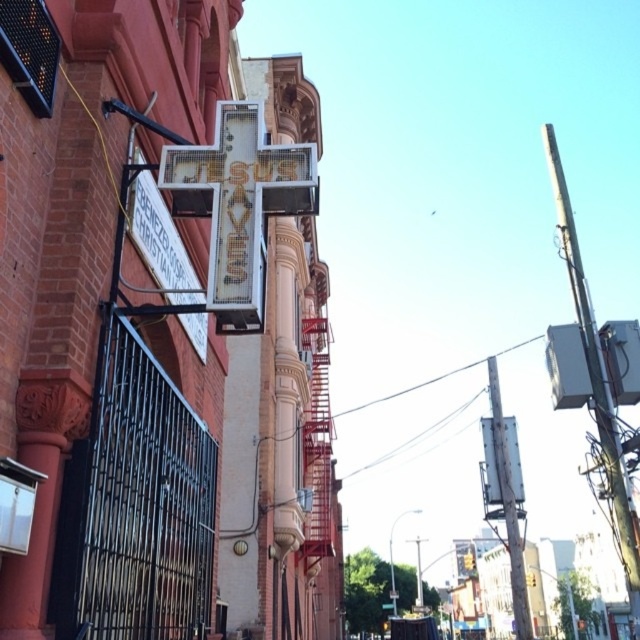
Question: Which object appears closest to the camera in this image?

Choices:
 (A) metallic gray pole at upper right
 (B) metallic gray sign at upper right

Answer: (A)

Question: Is metallic gray pole at upper right bigger than metallic gray sign at upper right?

Choices:
 (A) yes
 (B) no

Answer: (A)

Question: Does metallic gray pole at upper right have a larger size compared to metallic gray sign at upper right?

Choices:
 (A) no
 (B) yes

Answer: (B)

Question: Which point appears closest to the camera in this image?

Choices:
 (A) (525, 604)
 (B) (602, 435)

Answer: (B)

Question: Is metallic gray pole at upper right positioned before metallic gray sign at upper right?

Choices:
 (A) no
 (B) yes

Answer: (B)

Question: Which point is farther to the camera?

Choices:
 (A) metallic gray sign at upper right
 (B) metallic gray pole at upper right

Answer: (A)